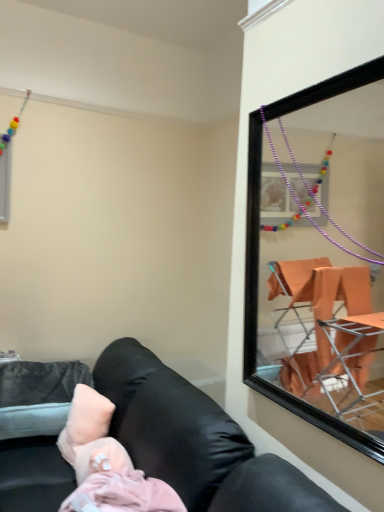
Question: From a real-world perspective, relative to pink fabric at lower left, is black leather couch at lower left vertically above or below?

Choices:
 (A) below
 (B) above

Answer: (A)

Question: Choose the correct answer: Is black leather couch at lower left inside pink fabric at lower left or outside it?

Choices:
 (A) outside
 (B) inside

Answer: (A)

Question: Which is farther from the pink fabric at lower left?

Choices:
 (A) black leather couch at lower left
 (B) pink fabric pillow at lower left

Answer: (B)

Question: Which object is the farthest from the pink fabric at lower left?

Choices:
 (A) pink fabric pillow at lower left
 (B) black leather couch at lower left

Answer: (A)